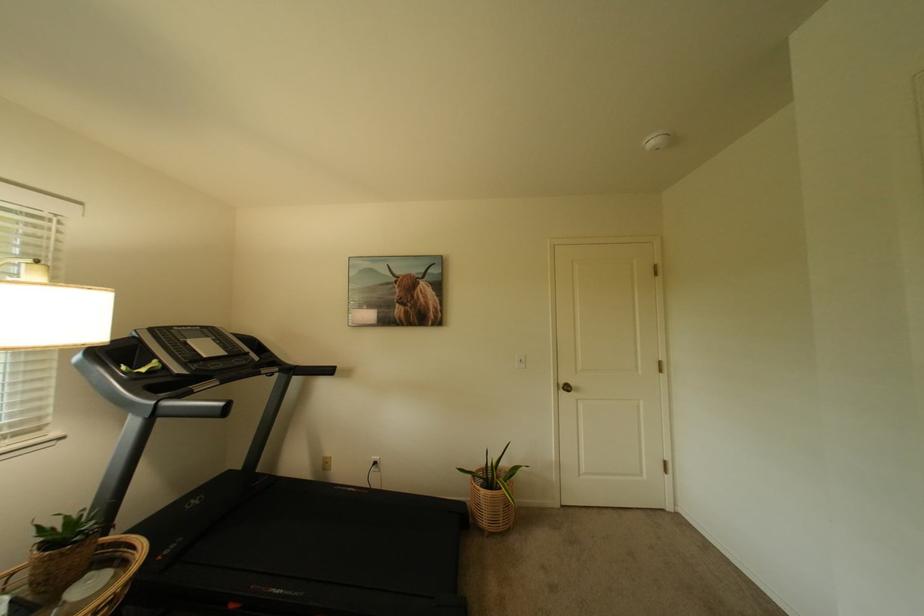
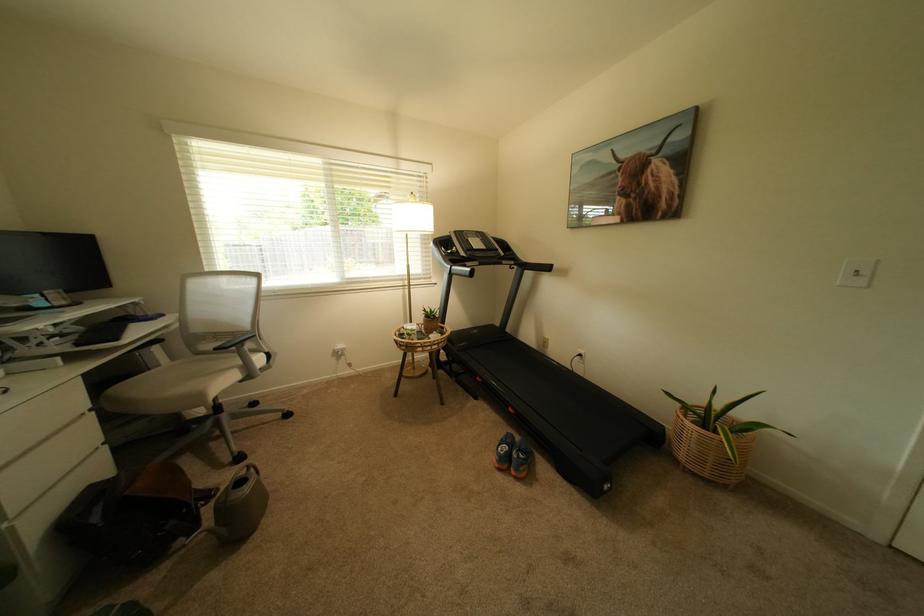
Find the pixel in the second image that matches pixel 233 354 in the first image.

(493, 249)